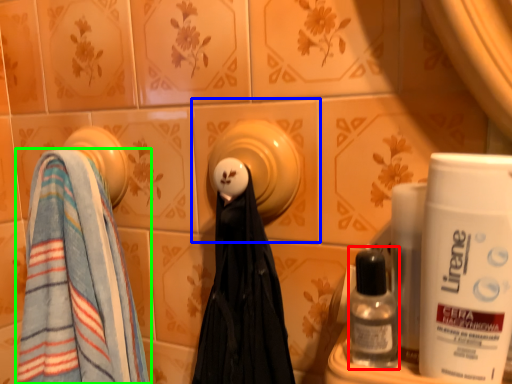
Question: Which object is positioned farthest from mouthwash (highlighted by a red box)? Select from ceramic tile (highlighted by a blue box) and towel (highlighted by a green box).

Choices:
 (A) ceramic tile
 (B) towel

Answer: (B)